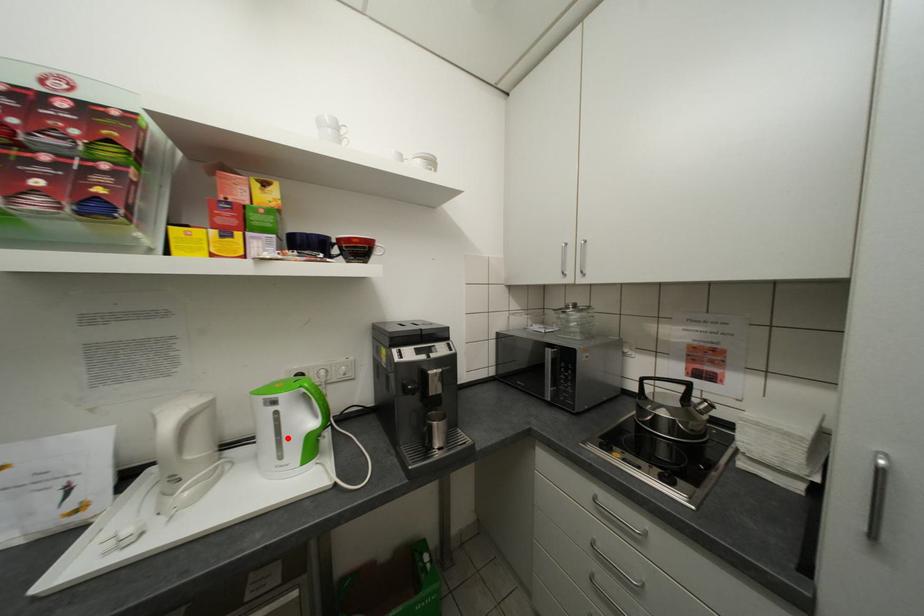
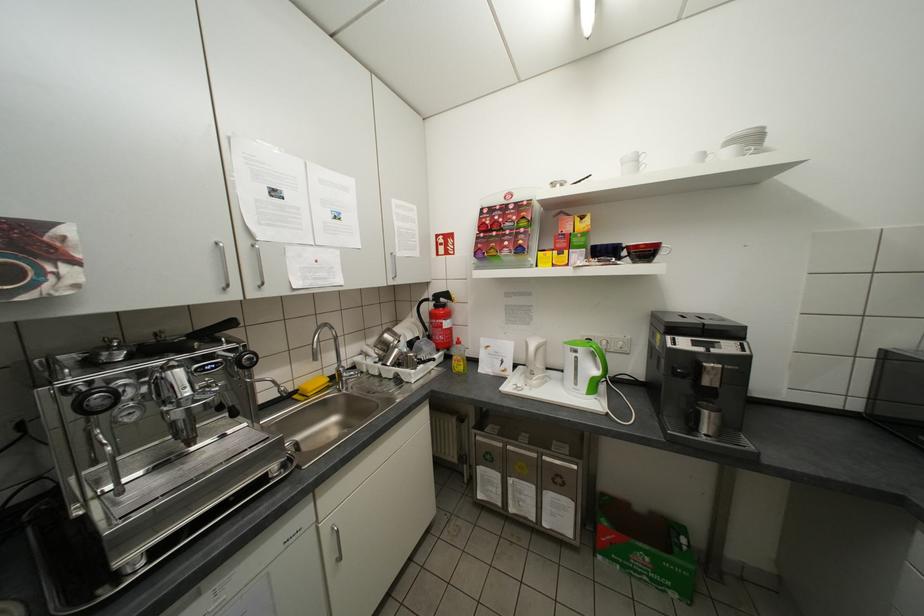
Question: A red point is marked in image1. In image2, is the corresponding 3D point closer to the camera or farther? Reply with the corresponding letter.

Choices:
 (A) The corresponding 3D point is closer.
 (B) The corresponding 3D point is farther.

Answer: (A)